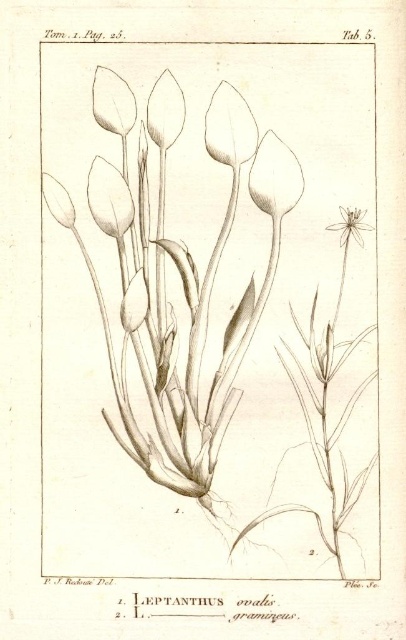
Question: Does matte white petal at center come behind matte white petal at upper left?

Choices:
 (A) yes
 (B) no

Answer: (A)

Question: Which point is closer to the camera taking this photo?

Choices:
 (A) (280, 157)
 (B) (123, 131)

Answer: (B)

Question: Where is matte white petal at center located in relation to matte white petal at upper left in the image?

Choices:
 (A) right
 (B) left

Answer: (A)

Question: Is matte white petal at center closer to the viewer compared to matte white petal at upper left?

Choices:
 (A) yes
 (B) no

Answer: (B)